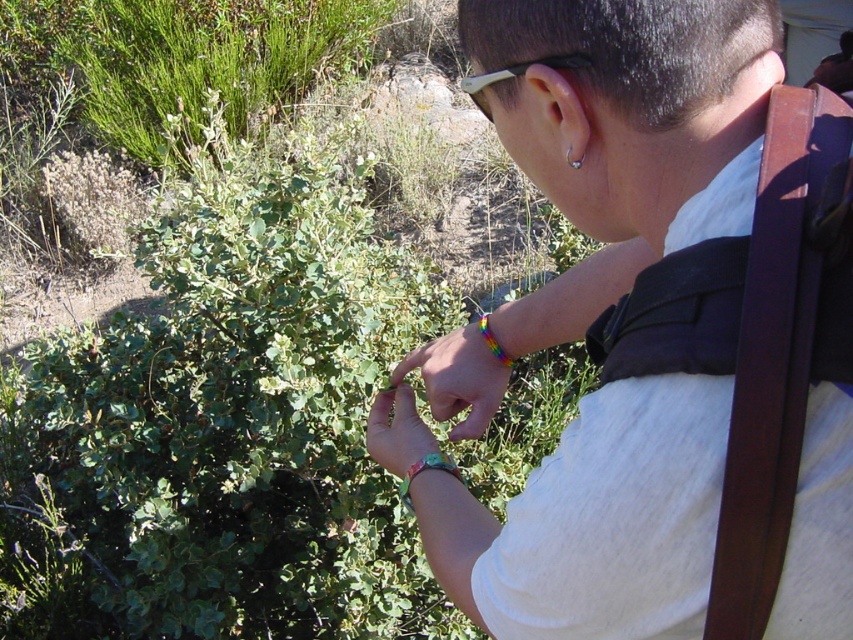
You are a hiker who just found a plant in a dry area. You have a rainbow bracelet at center and white plastic goggles at upper center. Which item is closer to you when looking at the plant?

The rainbow bracelet at center is closer to you because the white plastic goggles at upper center are positioned behind it.

You are a hiker who wants to check the distance between your rainbow bracelet at center and white plastic goggles at upper center. Which one is taller?

The rainbow bracelet at center is much taller than white plastic goggles at upper center according to the description.